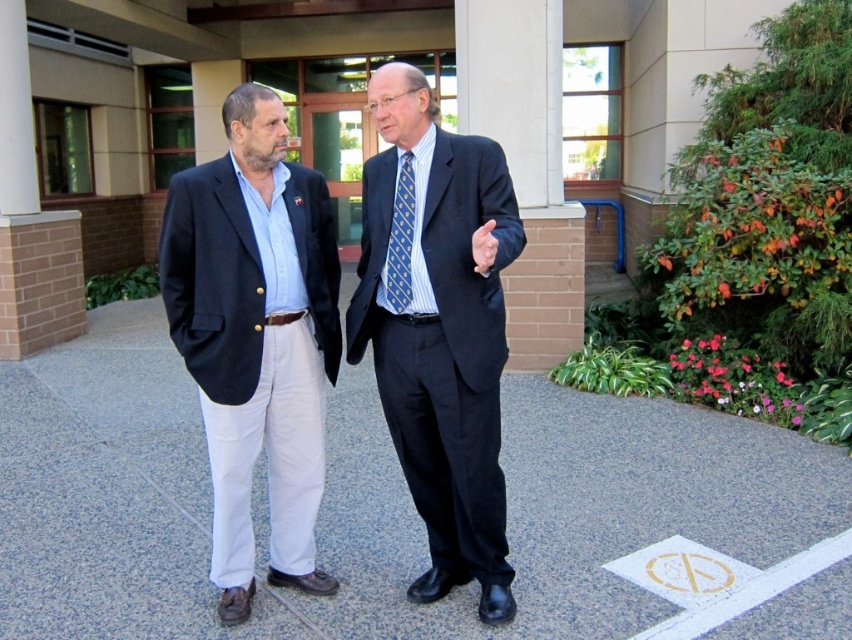
Question: Where is matte black suit at center located in relation to blue textured tie at center in the image?

Choices:
 (A) left
 (B) right

Answer: (B)

Question: Which point is closer to the camera taking this photo?

Choices:
 (A) [x=464, y=556]
 (B) [x=396, y=305]
 (C) [x=301, y=388]

Answer: (B)

Question: Estimate the real-world distances between objects in this image. Which object is farther from the matte black suit at center?

Choices:
 (A) matte black blazer at left
 (B) blue textured tie at center

Answer: (A)

Question: Does matte black blazer at left appear under blue textured tie at center?

Choices:
 (A) no
 (B) yes

Answer: (B)

Question: Can you confirm if matte black suit at center is positioned above blue textured tie at center?

Choices:
 (A) no
 (B) yes

Answer: (A)

Question: Which object is the farthest from the matte black suit at center?

Choices:
 (A) matte black blazer at left
 (B) blue textured tie at center

Answer: (A)